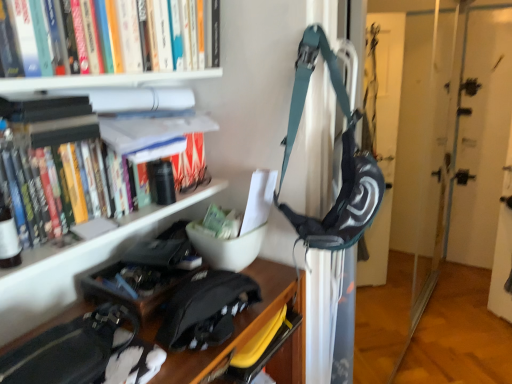
Question: Does teal fabric backpack at center have a smaller size compared to hardcover books at upper left?

Choices:
 (A) no
 (B) yes

Answer: (A)

Question: Is teal fabric backpack at center positioned far away from hardcover books at upper left?

Choices:
 (A) no
 (B) yes

Answer: (A)

Question: From a real-world perspective, is teal fabric backpack at center located higher than hardcover books at upper left?

Choices:
 (A) no
 (B) yes

Answer: (A)

Question: Considering the relative sizes of teal fabric backpack at center and hardcover books at upper left in the image provided, is teal fabric backpack at center thinner than hardcover books at upper left?

Choices:
 (A) yes
 (B) no

Answer: (A)

Question: From the image's perspective, is teal fabric backpack at center under hardcover books at upper left?

Choices:
 (A) no
 (B) yes

Answer: (B)

Question: Considering the relative positions of teal fabric backpack at center and hardcover books at upper left in the image provided, is teal fabric backpack at center to the right of hardcover books at upper left from the viewer's perspective?

Choices:
 (A) yes
 (B) no

Answer: (A)

Question: Does white matte bookshelf at upper left have a lesser height compared to black matte messenger bag at lower center?

Choices:
 (A) no
 (B) yes

Answer: (A)

Question: Is white matte bookshelf at upper left oriented towards black matte messenger bag at lower center?

Choices:
 (A) yes
 (B) no

Answer: (A)

Question: Considering the relative sizes of white matte bookshelf at upper left and black matte messenger bag at lower center in the image provided, is white matte bookshelf at upper left taller than black matte messenger bag at lower center?

Choices:
 (A) yes
 (B) no

Answer: (A)

Question: Would you say white matte bookshelf at upper left is outside black matte messenger bag at lower center?

Choices:
 (A) yes
 (B) no

Answer: (A)

Question: From a real-world perspective, is white matte bookshelf at upper left physically above black matte messenger bag at lower center?

Choices:
 (A) no
 (B) yes

Answer: (B)

Question: Can you confirm if white matte bookshelf at upper left is bigger than black matte messenger bag at lower center?

Choices:
 (A) yes
 (B) no

Answer: (A)

Question: Is white matte bookshelf at upper left surrounded by black matte messenger bag at lower center?

Choices:
 (A) yes
 (B) no

Answer: (B)